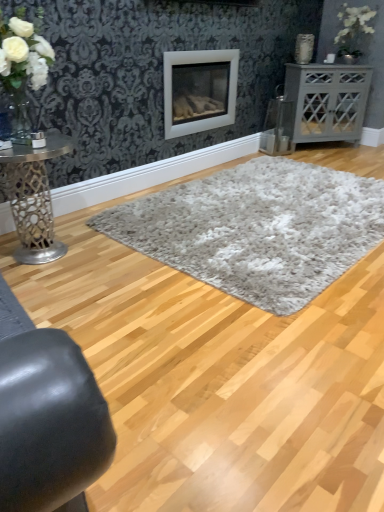
You are a GUI agent. You are given a task and a screenshot of the screen. Output one action in this format:
    pyautogui.click(x=<x>, y=<y>)
    Task: Click on the vacant point above white fluffy rug at center, which is counted as the 1th plain, starting from the back (from a real-world perspective)
    The height and width of the screenshot is (512, 384).
    Given the screenshot: What is the action you would take?
    pyautogui.click(x=274, y=207)